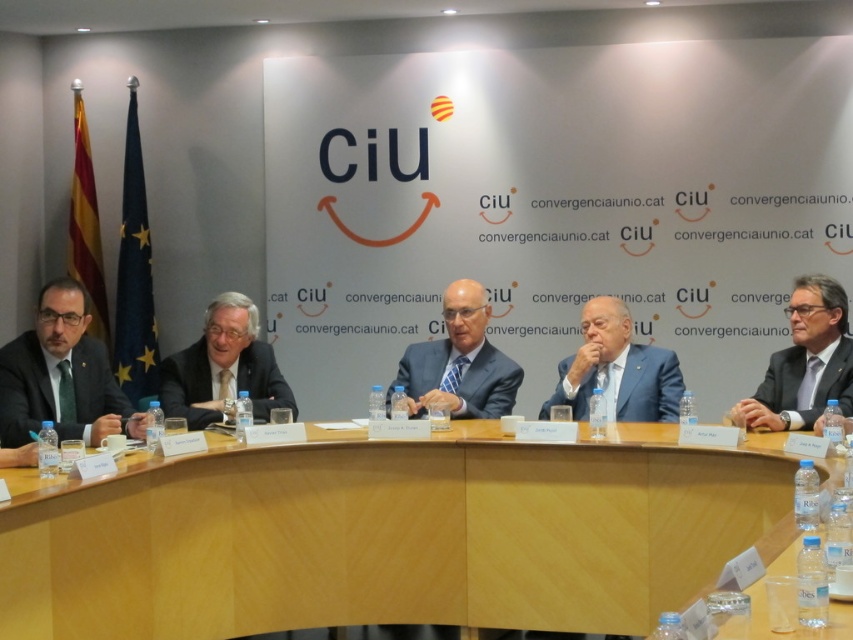
Between point (57, 378) and point (210, 344), which one is positioned in front?

Positioned in front is point (57, 378).

Which of these two, matte black suit at left or light blue suit at center, stands shorter?

light blue suit at center is shorter.

What do you see at coordinates (61, 376) in the screenshot?
I see `matte black suit at left` at bounding box center [61, 376].

Locate an element on the screen. Image resolution: width=853 pixels, height=640 pixels. matte black suit at left is located at coordinates (61, 376).

Who is positioned more to the left, matte black suit at right or blue glossy suit at center?

From the viewer's perspective, blue glossy suit at center appears more on the left side.

You are a GUI agent. You are given a task and a screenshot of the screen. Output one action in this format:
    pyautogui.click(x=<x>, y=<y>)
    Task: Click on the matte black suit at right
    Image resolution: width=853 pixels, height=640 pixels.
    Given the screenshot: What is the action you would take?
    pyautogui.click(x=805, y=362)

Which is behind, point (775, 426) or point (624, 378)?

Point (624, 378)

Locate an element on the screen. Image resolution: width=853 pixels, height=640 pixels. matte black suit at right is located at coordinates (805, 362).

Is point (206, 380) positioned behind point (469, 280)?

No.

Does light blue suit at center appear under blue suit at center?

Indeed, light blue suit at center is positioned under blue suit at center.

Image resolution: width=853 pixels, height=640 pixels. Find the location of `light blue suit at center`. light blue suit at center is located at coordinates (223, 368).